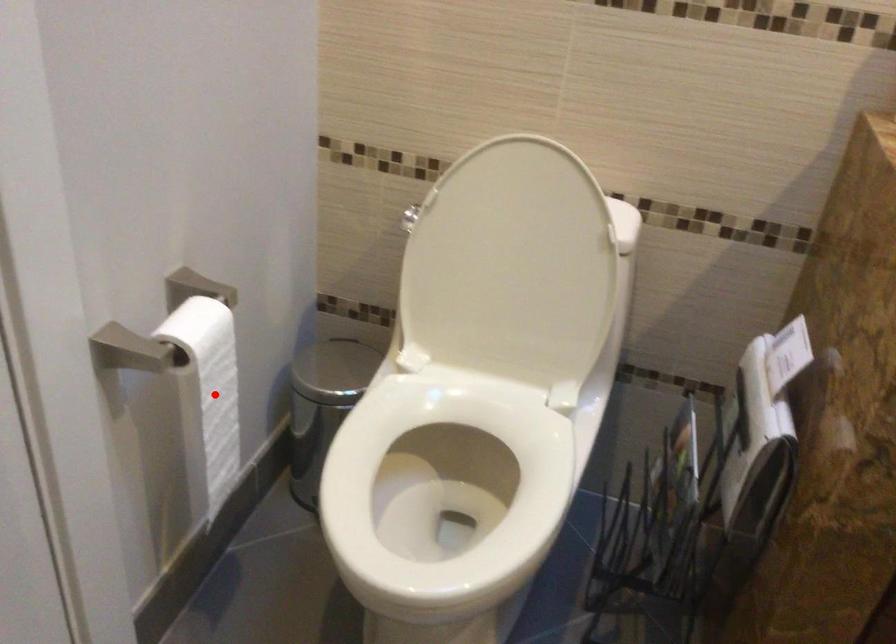
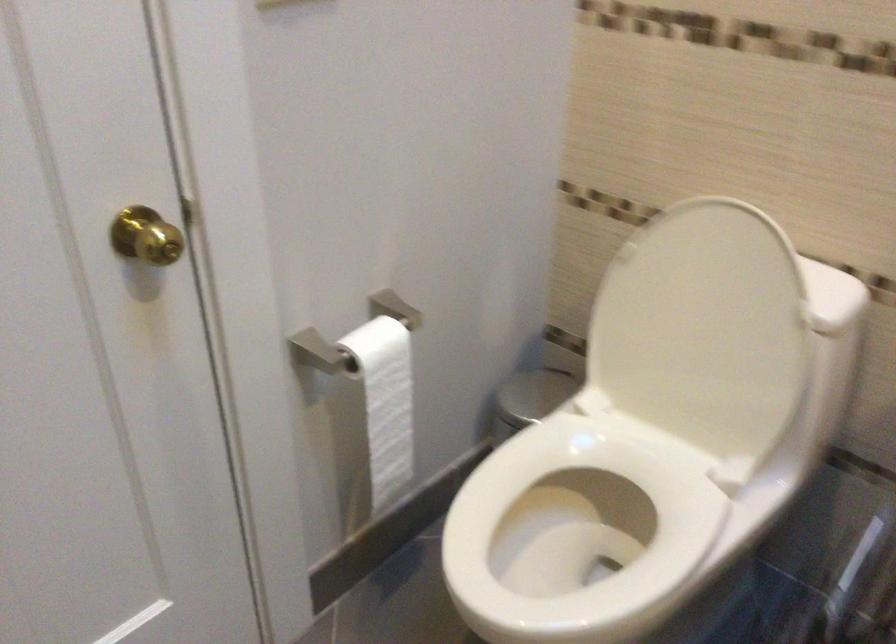
Question: I am providing you with two images of the same scene from different viewpoints. A red point is marked on the first image. Can you still see the location of the red point in image 2?

Choices:
 (A) Yes
 (B) No

Answer: (A)